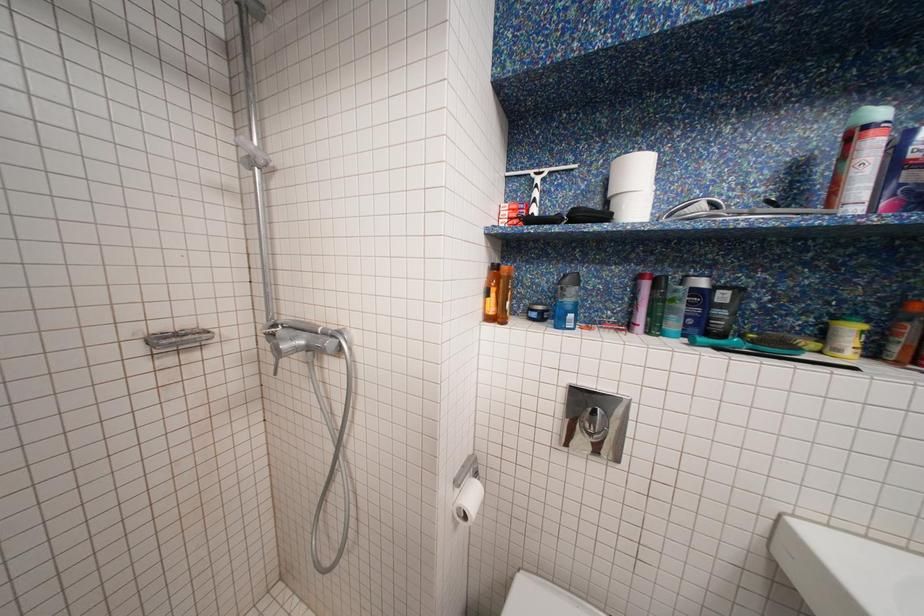
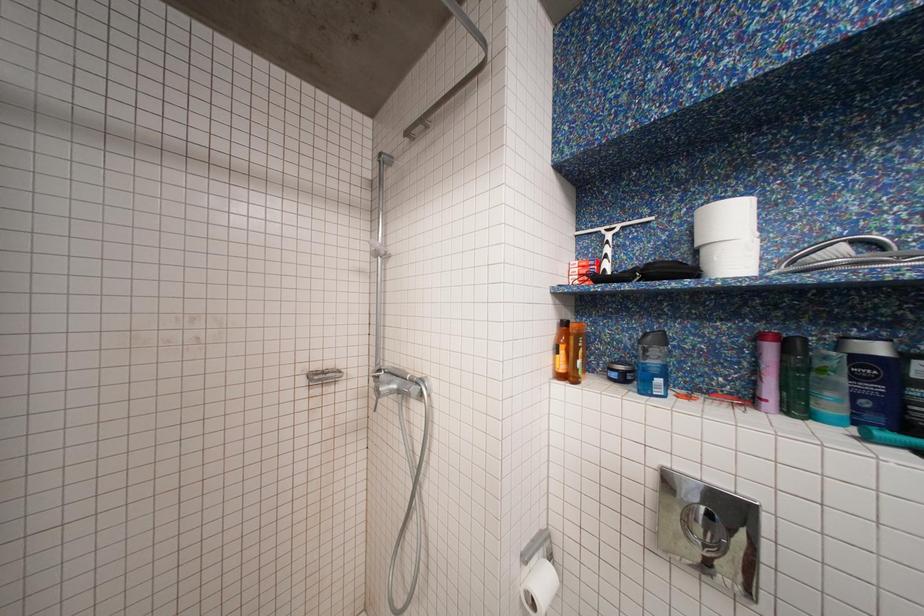
Question: The camera is either moving clockwise (left) or counter-clockwise (right) around the object. The first image is from the beginning of the video and the second image is from the end. Is the camera moving left or right when shooting the video?

Choices:
 (A) Left
 (B) Right

Answer: (B)